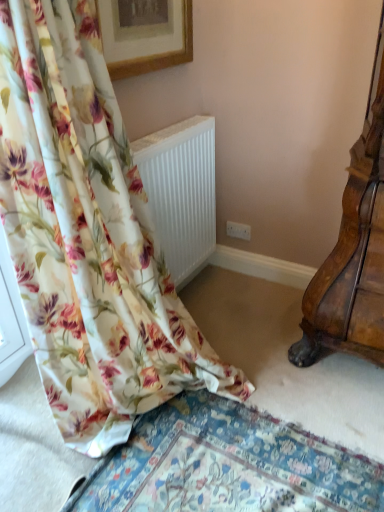
Question: Is white ribbed radiator at lower left positioned in front of wooden picture frame at upper center?

Choices:
 (A) yes
 (B) no

Answer: (B)

Question: Is white ribbed radiator at lower left further to the viewer compared to wooden picture frame at upper center?

Choices:
 (A) yes
 (B) no

Answer: (A)

Question: Is white ribbed radiator at lower left shorter than wooden picture frame at upper center?

Choices:
 (A) no
 (B) yes

Answer: (A)

Question: Are white ribbed radiator at lower left and wooden picture frame at upper center far apart?

Choices:
 (A) yes
 (B) no

Answer: (B)

Question: Is white ribbed radiator at lower left thinner than wooden picture frame at upper center?

Choices:
 (A) no
 (B) yes

Answer: (A)

Question: Would you say floral fabric curtain at left is inside or outside white ribbed radiator at lower left?

Choices:
 (A) inside
 (B) outside

Answer: (B)

Question: In terms of size, does floral fabric curtain at left appear bigger or smaller than white ribbed radiator at lower left?

Choices:
 (A) big
 (B) small

Answer: (A)

Question: From the image's perspective, is floral fabric curtain at left located above or below white ribbed radiator at lower left?

Choices:
 (A) above
 (B) below

Answer: (B)

Question: Is floral fabric curtain at left wider or thinner than white ribbed radiator at lower left?

Choices:
 (A) wide
 (B) thin

Answer: (A)

Question: Is point (134, 7) positioned closer to the camera than point (130, 350)?

Choices:
 (A) farther
 (B) closer

Answer: (A)

Question: In terms of width, does wooden picture frame at upper center look wider or thinner when compared to floral fabric curtain at left?

Choices:
 (A) thin
 (B) wide

Answer: (A)

Question: Considering the positions of wooden picture frame at upper center and floral fabric curtain at left in the image, is wooden picture frame at upper center taller or shorter than floral fabric curtain at left?

Choices:
 (A) tall
 (B) short

Answer: (B)

Question: Would you say wooden picture frame at upper center is to the left or to the right of floral fabric curtain at left in the picture?

Choices:
 (A) right
 (B) left

Answer: (A)

Question: From a real-world perspective, relative to white ribbed radiator at lower left, is wooden picture frame at upper center vertically above or below?

Choices:
 (A) above
 (B) below

Answer: (A)

Question: Does point (130, 18) appear closer or farther from the camera than point (168, 156)?

Choices:
 (A) closer
 (B) farther

Answer: (A)